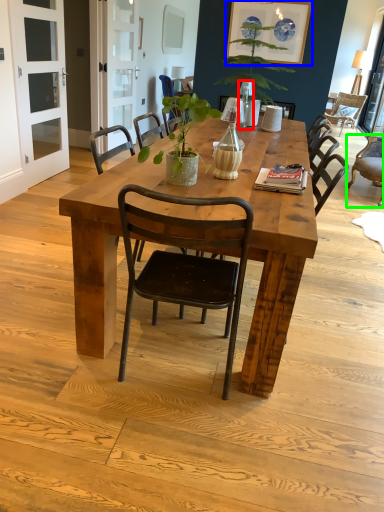
Question: Which object is the closest to the lamp (highlighted by a red box)? Choose among these: painting (highlighted by a blue box) or chair (highlighted by a green box).

Choices:
 (A) painting
 (B) chair

Answer: (A)